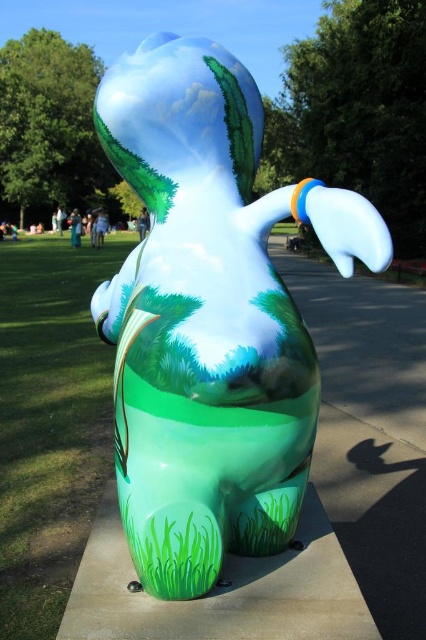
Which is more to the left, glossy ceramic rabbit at center or green matte grass at lower left?

From the viewer's perspective, green matte grass at lower left appears more on the left side.

Which is behind, point (317, 196) or point (54, 556)?

The point (54, 556) is behind.

Between point (198, 456) and point (2, 572), which one is positioned behind?

The point (2, 572) is behind.

Locate an element on the screen. This screenshot has height=640, width=426. glossy ceramic rabbit at center is located at coordinates (210, 316).